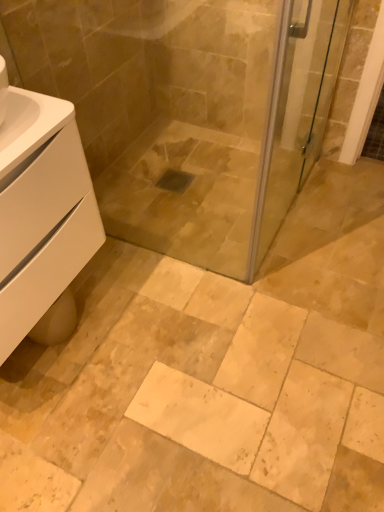
Question: Is white matte cabinet at lower left inside the boundaries of transparent glass screen door at upper right, or outside?

Choices:
 (A) outside
 (B) inside

Answer: (A)

Question: Is point (97, 205) closer or farther from the camera than point (253, 245)?

Choices:
 (A) farther
 (B) closer

Answer: (A)

Question: In the image, is white matte cabinet at lower left positioned in front of or behind transparent glass screen door at upper right?

Choices:
 (A) front
 (B) behind

Answer: (A)

Question: In terms of height, does transparent glass screen door at upper right look taller or shorter compared to white matte cabinet at lower left?

Choices:
 (A) tall
 (B) short

Answer: (A)

Question: Based on their positions, is transparent glass screen door at upper right located to the left or right of white matte cabinet at lower left?

Choices:
 (A) right
 (B) left

Answer: (A)

Question: Relative to white matte cabinet at lower left, is transparent glass screen door at upper right in front or behind?

Choices:
 (A) front
 (B) behind

Answer: (B)

Question: From a real-world perspective, is transparent glass screen door at upper right physically located above or below white matte cabinet at lower left?

Choices:
 (A) below
 (B) above

Answer: (A)